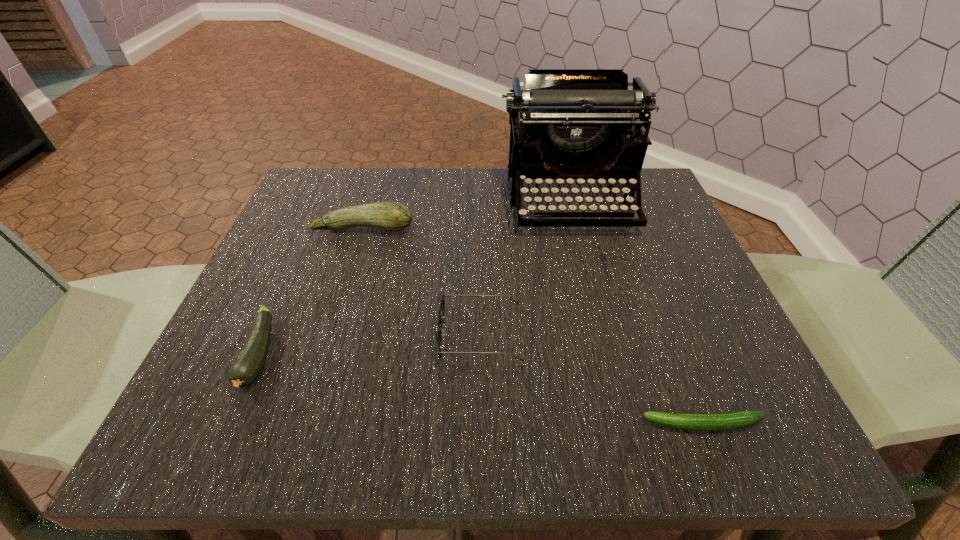
This screenshot has height=540, width=960. I want to click on object that ranks as the fourth closest to the nearest zucchini, so click(246, 367).

Identify the location of the closest zucchini to the tallest zucchini. (246, 367).

This screenshot has height=540, width=960. Identify the location of the second closest zucchini relative to the second nearest zucchini. (729, 421).

Image resolution: width=960 pixels, height=540 pixels. I want to click on vacant position in the image that satisfies the following two spatial constraints: 1. on the typing side of the tallest object; 2. through the lenses of the spectacles, so click(606, 336).